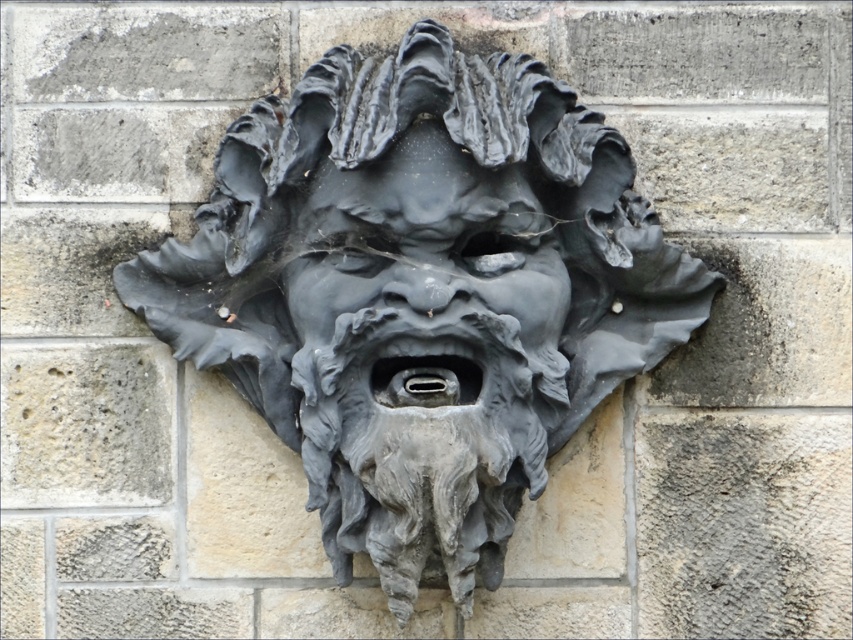
Is matte gray stone mask at center wider than matte gray stone face at center?

Indeed, matte gray stone mask at center has a greater width compared to matte gray stone face at center.

Which is in front, point (550, 252) or point (392, 202)?

Point (392, 202)

Identify the location of matte gray stone mask at center. (421, 294).